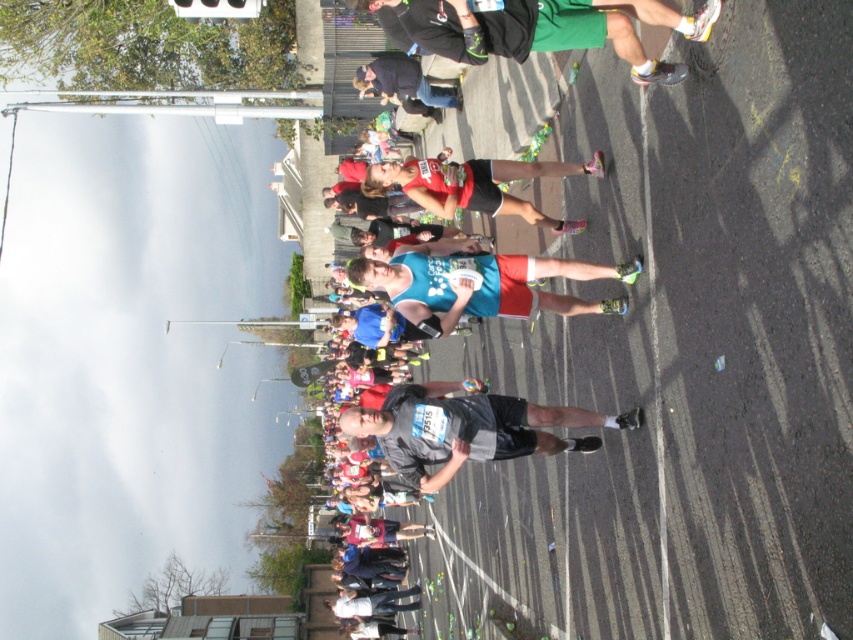
Can you confirm if dark gray fabric shirt at center is shorter than blue fabric shorts at center?

In fact, dark gray fabric shirt at center may be taller than blue fabric shorts at center.

Can you confirm if dark gray fabric shirt at center is smaller than blue fabric shorts at center?

No.

This screenshot has height=640, width=853. What are the coordinates of `dark gray fabric shirt at center` in the screenshot? It's located at (468, 428).

Locate an element on the screen. The width and height of the screenshot is (853, 640). dark gray fabric shirt at center is located at coordinates (468, 428).